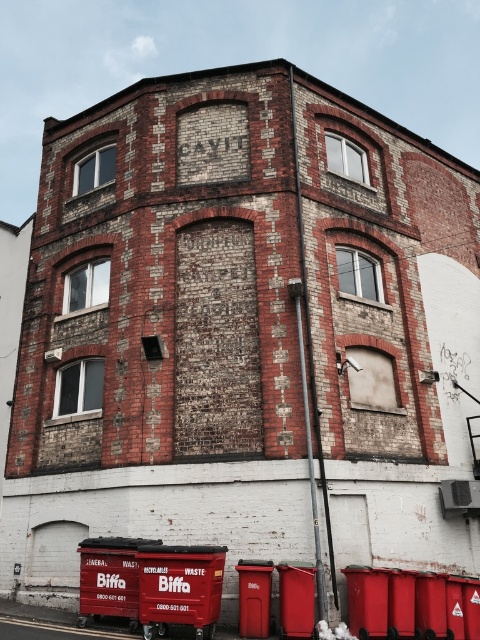
Is point (162, 604) farther from viewer compared to point (312, 566)?

That is False.

Is matte red bin at lower center closer to the viewer compared to metallic red bin at lower right?

Yes, it is in front of metallic red bin at lower right.

Who is more distant from viewer, (x=201, y=561) or (x=280, y=611)?

Point (x=280, y=611)

I want to click on matte red bin at lower center, so click(x=180, y=588).

At what (x,y) coordinates should I click in order to perform the action: click on matte red bin at lower center. Please return your answer as a coordinate pair (x, y). The height and width of the screenshot is (640, 480). Looking at the image, I should click on (180, 588).

Is the position of matte red bin at lower center more distant than that of red plastic bin at lower center?

No, it is not.

Is point (196, 588) behind point (265, 624)?

No, (196, 588) is in front of (265, 624).

I want to click on matte red bin at lower center, so click(180, 588).

In the scene shown: Is metallic red bin at lower right further to camera compared to red plastic bin at lower center?

No.

This screenshot has width=480, height=640. What do you see at coordinates (297, 598) in the screenshot? I see `metallic red bin at lower right` at bounding box center [297, 598].

Find the location of a particular element. The width and height of the screenshot is (480, 640). metallic red bin at lower right is located at coordinates (297, 598).